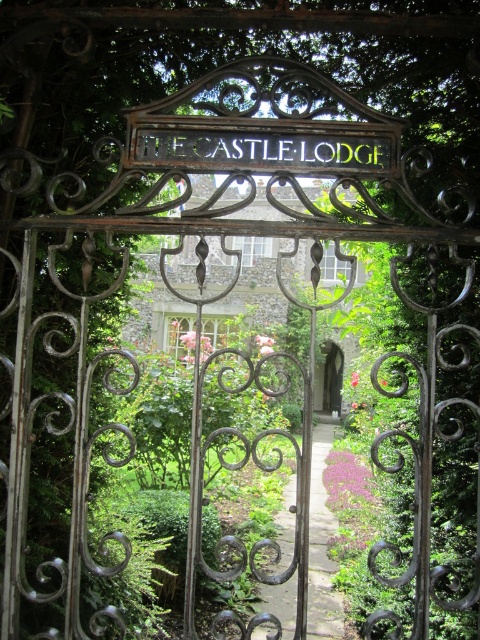
Between gold metallic sign at center and smooth stone archway at center, which one is positioned higher?

Positioned higher is gold metallic sign at center.

Can you confirm if gold metallic sign at center is positioned below smooth stone archway at center?

No, gold metallic sign at center is not below smooth stone archway at center.

Does point (269, 150) come farther from viewer compared to point (317, 396)?

No, (269, 150) is in front of (317, 396).

Where is `gold metallic sign at center`? gold metallic sign at center is located at coordinates (263, 150).